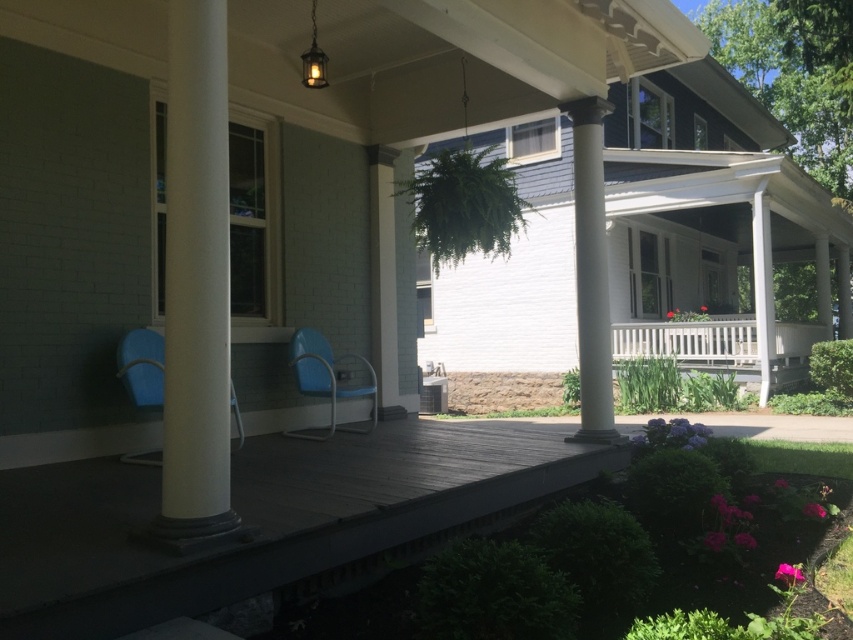
Question: Which of the following is the closest to the observer?

Choices:
 (A) (563, 102)
 (B) (142, 460)
 (C) (318, 353)

Answer: (B)

Question: Does white polished column at center have a smaller size compared to white smooth column at center?

Choices:
 (A) no
 (B) yes

Answer: (A)

Question: Which of these objects is positioned closest to the white wooden railing at center?

Choices:
 (A) white smooth column at center
 (B) blue plastic rocking chair at center
 (C) metallic blue chair at center
 (D) white glossy column at center

Answer: (A)

Question: Which point appears farthest from the camera in this image?

Choices:
 (A) (306, 384)
 (B) (154, 333)

Answer: (A)

Question: Observing the image, what is the correct spatial positioning of blue plastic rocking chair at center in reference to white smooth column at center?

Choices:
 (A) below
 (B) above

Answer: (A)

Question: Can you confirm if blue plastic rocking chair at center is positioned to the left of white smooth column at center?

Choices:
 (A) no
 (B) yes

Answer: (B)